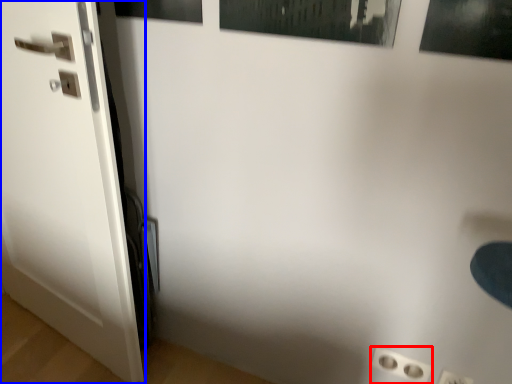
Question: Which point is closer to the camera, electric outlet (highlighted by a red box) or door (highlighted by a blue box)?

Choices:
 (A) electric outlet
 (B) door

Answer: (B)